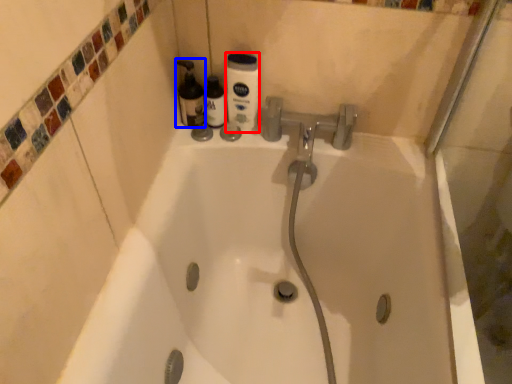
Question: Which point is further to the camera, cleaning product (highlighted by a red box) or cleaning product (highlighted by a blue box)?

Choices:
 (A) cleaning product
 (B) cleaning product

Answer: (B)